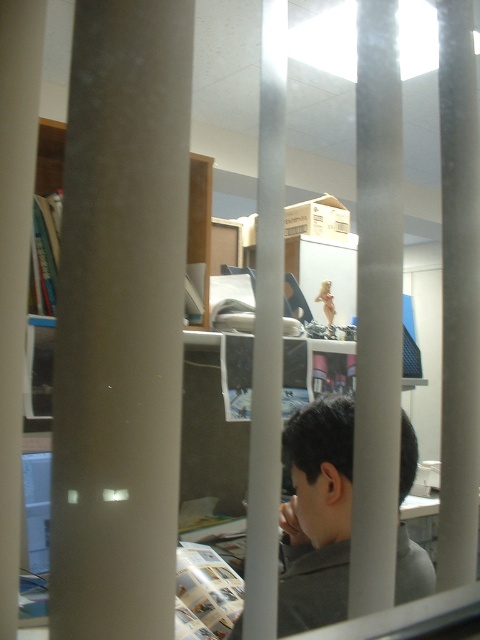
Question: Does matte gray pillar at center lie in front of gray matte shirt at center?

Choices:
 (A) yes
 (B) no

Answer: (A)

Question: Does matte gray pillar at center appear on the left side of gray matte shirt at center?

Choices:
 (A) no
 (B) yes

Answer: (B)

Question: Which of the following is the closest to the observer?

Choices:
 (A) (142, 170)
 (B) (398, 541)

Answer: (A)

Question: Among these points, which one is nearest to the camera?

Choices:
 (A) (285, 458)
 (B) (86, 262)

Answer: (B)

Question: Does matte gray pillar at center have a greater width compared to gray matte shirt at center?

Choices:
 (A) yes
 (B) no

Answer: (B)